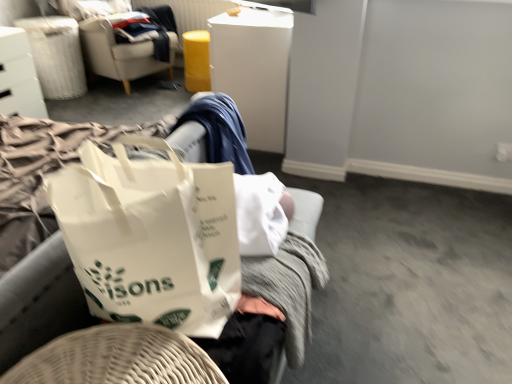
What is the approximate width of white glossy drawer at upper left, arranged as the 2th furniture when viewed from the front?

50.00 centimeters.

The width and height of the screenshot is (512, 384). What do you see at coordinates (39, 302) in the screenshot?
I see `white paper bag at center, the 2th furniture when ordered from back to front` at bounding box center [39, 302].

Where is `beige fabric chair at upper left`? This screenshot has width=512, height=384. beige fabric chair at upper left is located at coordinates (121, 53).

The image size is (512, 384). Describe the element at coordinates (254, 69) in the screenshot. I see `white plastic file cabinet at upper center` at that location.

Locate an element on the screen. This screenshot has width=512, height=384. white glossy drawer at upper left, arranged as the 2th furniture when ordered from the bottom is located at coordinates (19, 76).

Could you tell me if white fabric laundry basket at upper left is turned towards white plastic file cabinet at upper center?

Yes, white fabric laundry basket at upper left is oriented towards white plastic file cabinet at upper center.

Which is behind, point (49, 65) or point (270, 104)?

Point (49, 65)

Considering the sizes of objects white fabric laundry basket at upper left and white plastic file cabinet at upper center in the image provided, who is smaller, white fabric laundry basket at upper left or white plastic file cabinet at upper center?

white fabric laundry basket at upper left is smaller.

Considering the points (48, 83) and (114, 44), which point is in front, point (48, 83) or point (114, 44)?

The point (114, 44) is closer to the camera.

At what (x,y) coordinates should I click in order to perform the action: click on chair that is on the right side of white fabric laundry basket at upper left. Please return your answer as a coordinate pair (x, y). The height and width of the screenshot is (384, 512). Looking at the image, I should click on (121, 53).

Are white fabric laundry basket at upper left and beige fabric chair at upper left making contact?

No, white fabric laundry basket at upper left is not with beige fabric chair at upper left.

Who is taller, white fabric laundry basket at upper left or beige fabric chair at upper left?

beige fabric chair at upper left.

Is white paper bag at center, positioned as the 2th furniture in left-to-right order, completely or partially inside beige fabric chair at upper left?

No.

Is point (115, 40) less distant than point (24, 230)?

No, (115, 40) is behind (24, 230).

Can you confirm if beige fabric chair at upper left is shorter than white paper bag at center, which ranks as the first furniture in bottom-to-top order?

No, beige fabric chair at upper left is not shorter than white paper bag at center, which ranks as the first furniture in bottom-to-top order.

Is beige fabric chair at upper left facing towards white paper bag at center, positioned as the 2th furniture in left-to-right order?

No, beige fabric chair at upper left is not aimed at white paper bag at center, positioned as the 2th furniture in left-to-right order.

Which object is positioned more to the right, white plastic file cabinet at upper center or white fabric laundry basket at upper left?

Positioned to the right is white plastic file cabinet at upper center.

Does point (267, 52) lie behind point (44, 64)?

No, (267, 52) is closer to viewer.

From a real-world perspective, is white plastic file cabinet at upper center over white fabric laundry basket at upper left?

Yes, from a real-world perspective, white plastic file cabinet at upper center is on top of white fabric laundry basket at upper left.

Is beige fabric chair at upper left at the back of white plastic file cabinet at upper center?

No, white plastic file cabinet at upper center is not facing away from beige fabric chair at upper left.

Which object is positioned more to the left, white plastic file cabinet at upper center or beige fabric chair at upper left?

beige fabric chair at upper left.

Does white plastic file cabinet at upper center lie behind beige fabric chair at upper left?

No, the depth of white plastic file cabinet at upper center is less than that of beige fabric chair at upper left.

Is point (244, 114) closer or farther from the camera than point (94, 37)?

Clearly, point (244, 114) is closer to the camera than point (94, 37).

Which is behind, point (87, 53) or point (13, 110)?

The point (87, 53) is farther.

From the image's perspective, is beige fabric chair at upper left located above or below white glossy drawer at upper left, which is the 1th furniture from top to bottom?

beige fabric chair at upper left is situated higher than white glossy drawer at upper left, which is the 1th furniture from top to bottom, in the image.

Is beige fabric chair at upper left further to the viewer compared to white glossy drawer at upper left, the first furniture positioned from the back?

Yes, beige fabric chair at upper left is further from the viewer.

Could you tell me if beige fabric chair at upper left is facing white glossy drawer at upper left, which appears as the 1th furniture when viewed from the left?

No, beige fabric chair at upper left does not turn towards white glossy drawer at upper left, which appears as the 1th furniture when viewed from the left.

How different are the orientations of white fabric laundry basket at upper left and white paper bag at center, positioned as the 2th furniture in left-to-right order, in degrees?

0.707 degrees separate the facing orientations of white fabric laundry basket at upper left and white paper bag at center, positioned as the 2th furniture in left-to-right order.

In the scene shown: Is white fabric laundry basket at upper left oriented towards white paper bag at center, which is counted as the first furniture, starting from the right?

No, white fabric laundry basket at upper left is not turned towards white paper bag at center, which is counted as the first furniture, starting from the right.

Is white fabric laundry basket at upper left taller than white paper bag at center, positioned as the 2th furniture in left-to-right order?

Indeed, white fabric laundry basket at upper left has a greater height compared to white paper bag at center, positioned as the 2th furniture in left-to-right order.

Between white fabric laundry basket at upper left and white paper bag at center, which is counted as the first furniture, starting from the right, which one appears on the left side from the viewer's perspective?

From the viewer's perspective, white fabric laundry basket at upper left appears more on the left side.

The image size is (512, 384). I want to click on laundry basket on the left side of white plastic file cabinet at upper center, so click(56, 55).

You are a GUI agent. You are given a task and a screenshot of the screen. Output one action in this format:
    pyautogui.click(x=<x>, y=<y>)
    Task: Click on the chair above the white fabric laundry basket at upper left (from the image's perspective)
    
    Given the screenshot: What is the action you would take?
    pyautogui.click(x=121, y=53)

From the image, which object appears to be nearer to white paper bag at center, positioned as the 2th furniture in left-to-right order, beige fabric chair at upper left or white fabric laundry basket at upper left?

Among the two, white fabric laundry basket at upper left is located nearer to white paper bag at center, positioned as the 2th furniture in left-to-right order.

When comparing their distances from white paper bag at center, which is counted as the first furniture, starting from the right, does white fabric laundry basket at upper left or beige fabric chair at upper left seem further?

The object further to white paper bag at center, which is counted as the first furniture, starting from the right, is beige fabric chair at upper left.

Looking at the image, which one is located closer to beige fabric chair at upper left, white glossy drawer at upper left, arranged as the 2th furniture when viewed from the front, or white paper bag at center, which is counted as the first furniture, starting from the right?

The object closer to beige fabric chair at upper left is white glossy drawer at upper left, arranged as the 2th furniture when viewed from the front.

From the image, which object appears to be nearer to beige fabric chair at upper left, white glossy drawer at upper left, which appears as the 1th furniture when viewed from the left, or white plastic file cabinet at upper center?

white glossy drawer at upper left, which appears as the 1th furniture when viewed from the left.

Which object lies nearer to the anchor point white plastic file cabinet at upper center, white fabric laundry basket at upper left or white glossy drawer at upper left, which appears as the 1th furniture when viewed from the left?

white glossy drawer at upper left, which appears as the 1th furniture when viewed from the left, is closer to white plastic file cabinet at upper center.

From the image, which object appears to be nearer to white paper bag at center, which ranks as the first furniture in front-to-back order, white fabric laundry basket at upper left or white glossy drawer at upper left, which appears as the 1th furniture when viewed from the left?

The object closer to white paper bag at center, which ranks as the first furniture in front-to-back order, is white glossy drawer at upper left, which appears as the 1th furniture when viewed from the left.

Based on their spatial positions, is white glossy drawer at upper left, which appears as the 1th furniture when viewed from the left, or beige fabric chair at upper left further from white plastic file cabinet at upper center?

Based on the image, white glossy drawer at upper left, which appears as the 1th furniture when viewed from the left, appears to be further to white plastic file cabinet at upper center.

From the image, which object appears to be farther from white plastic file cabinet at upper center, white fabric laundry basket at upper left or white paper bag at center, positioned as the 2th furniture in left-to-right order?

white paper bag at center, positioned as the 2th furniture in left-to-right order.

This screenshot has height=384, width=512. What are the coordinates of `chair located between white paper bag at center, which ranks as the first furniture in bottom-to-top order, and white fabric laundry basket at upper left in the depth direction` in the screenshot? It's located at (121, 53).

Where is `chair positioned between white glossy drawer at upper left, the 2th furniture when ordered from right to left, and white fabric laundry basket at upper left from near to far`? chair positioned between white glossy drawer at upper left, the 2th furniture when ordered from right to left, and white fabric laundry basket at upper left from near to far is located at coordinates (121, 53).

Identify the location of laundry basket between white glossy drawer at upper left, arranged as the 2th furniture when ordered from the bottom, and white plastic file cabinet at upper center, in the horizontal direction. [x=56, y=55].

Identify the location of file cabinet located between white paper bag at center, the second furniture when ordered from top to bottom, and white fabric laundry basket at upper left in the depth direction. The height and width of the screenshot is (384, 512). coord(254,69).